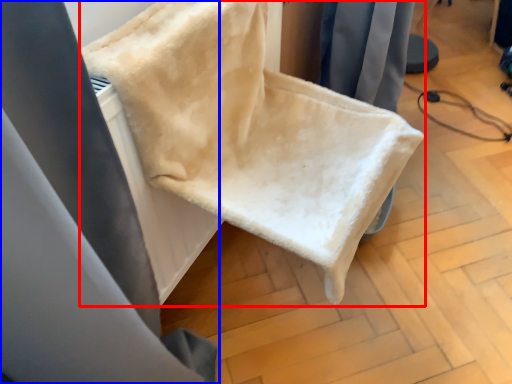
Question: Which object appears closest to the camera in this image, furniture (highlighted by a red box) or curtain (highlighted by a blue box)?

Choices:
 (A) furniture
 (B) curtain

Answer: (A)